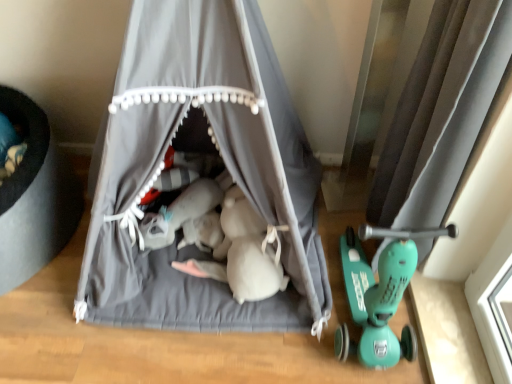
Question: Can you confirm if gray fabric tent at center, which ranks as the 2th curtain in right-to-left order, is wider than silky gray curtain at right, acting as the 2th curtain starting from the left?

Choices:
 (A) yes
 (B) no

Answer: (A)

Question: Does gray fabric tent at center, which ranks as the 2th curtain in right-to-left order, come in front of silky gray curtain at right, acting as the 2th curtain starting from the left?

Choices:
 (A) yes
 (B) no

Answer: (A)

Question: Is silky gray curtain at right, positioned as the first curtain in right-to-left order, completely or partially inside gray fabric tent at center, which ranks as the 2th curtain in right-to-left order?

Choices:
 (A) no
 (B) yes

Answer: (A)

Question: Does gray fabric tent at center, which ranks as the 2th curtain in right-to-left order, have a smaller size compared to silky gray curtain at right, acting as the 2th curtain starting from the left?

Choices:
 (A) no
 (B) yes

Answer: (A)

Question: Is gray fabric tent at center, which ranks as the 2th curtain in right-to-left order, at the right side of silky gray curtain at right, positioned as the first curtain in right-to-left order?

Choices:
 (A) no
 (B) yes

Answer: (A)

Question: Is the depth of gray fabric tent at center, which ranks as the 2th curtain in right-to-left order, greater than that of silky gray curtain at right, positioned as the first curtain in right-to-left order?

Choices:
 (A) yes
 (B) no

Answer: (B)

Question: Is silky gray curtain at right, positioned as the first curtain in right-to-left order, wider than gray fabric tent at center, which is the first curtain in left-to-right order?

Choices:
 (A) no
 (B) yes

Answer: (A)

Question: From the image's perspective, does silky gray curtain at right, acting as the 2th curtain starting from the left, appear lower than gray fabric tent at center, which is the first curtain in left-to-right order?

Choices:
 (A) yes
 (B) no

Answer: (A)

Question: Considering the relative sizes of silky gray curtain at right, acting as the 2th curtain starting from the left, and gray fabric tent at center, which ranks as the 2th curtain in right-to-left order, in the image provided, is silky gray curtain at right, acting as the 2th curtain starting from the left, taller than gray fabric tent at center, which ranks as the 2th curtain in right-to-left order,?

Choices:
 (A) no
 (B) yes

Answer: (A)

Question: Does silky gray curtain at right, acting as the 2th curtain starting from the left, have a lesser width compared to gray fabric tent at center, which is the first curtain in left-to-right order?

Choices:
 (A) yes
 (B) no

Answer: (A)

Question: Is silky gray curtain at right, acting as the 2th curtain starting from the left, placed right next to gray fabric tent at center, which ranks as the 2th curtain in right-to-left order?

Choices:
 (A) yes
 (B) no

Answer: (B)

Question: Is silky gray curtain at right, acting as the 2th curtain starting from the left, outside of gray fabric tent at center, which is the first curtain in left-to-right order?

Choices:
 (A) no
 (B) yes

Answer: (B)

Question: Is silky gray curtain at right, acting as the 2th curtain starting from the left, in front of or behind gray fabric tent at center, which ranks as the 2th curtain in right-to-left order, in the image?

Choices:
 (A) behind
 (B) front

Answer: (A)